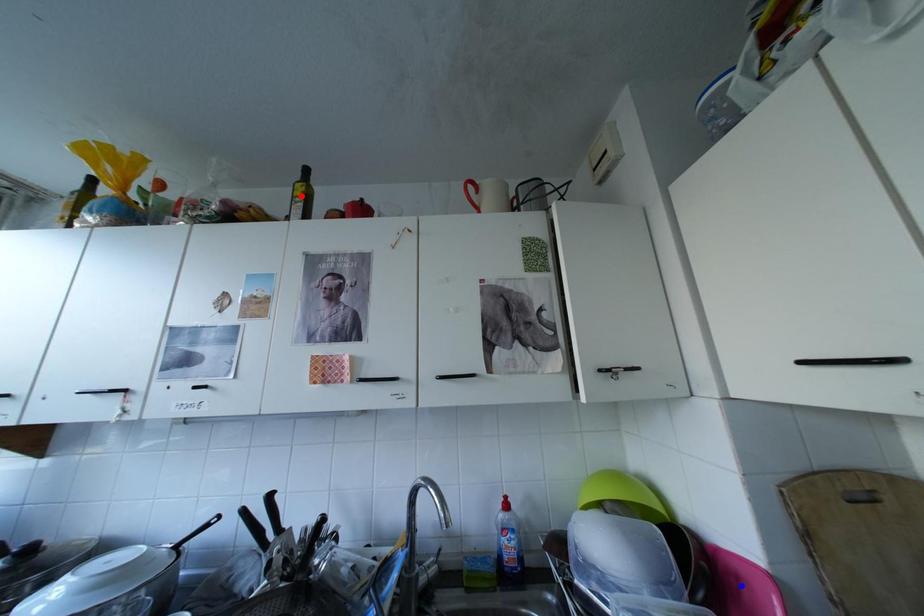
Question: Two points are marked on the image. Which point is closer to the camera?

Choices:
 (A) Blue point is closer.
 (B) Red point is closer.

Answer: (A)